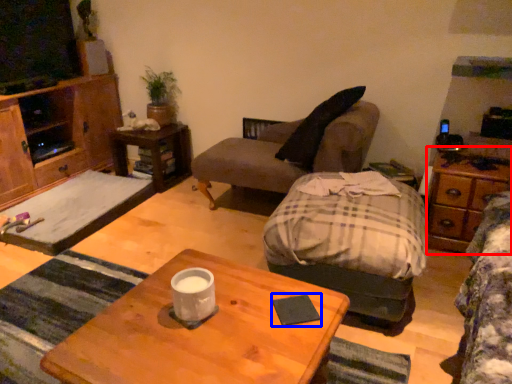
Question: Which object is further to the camera taking this photo, dresser (highlighted by a red box) or pad (highlighted by a blue box)?

Choices:
 (A) dresser
 (B) pad

Answer: (A)